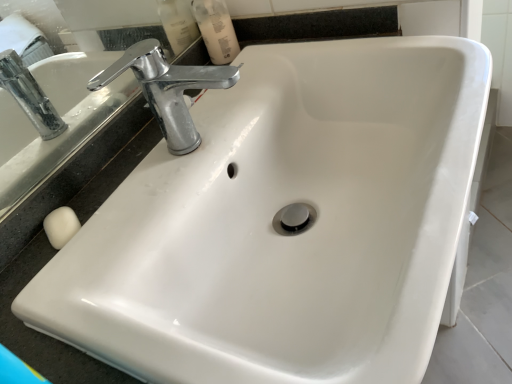
Locate an element on the screen. vacant region to the left of chrome metallic faucet at upper left is located at coordinates (122, 206).